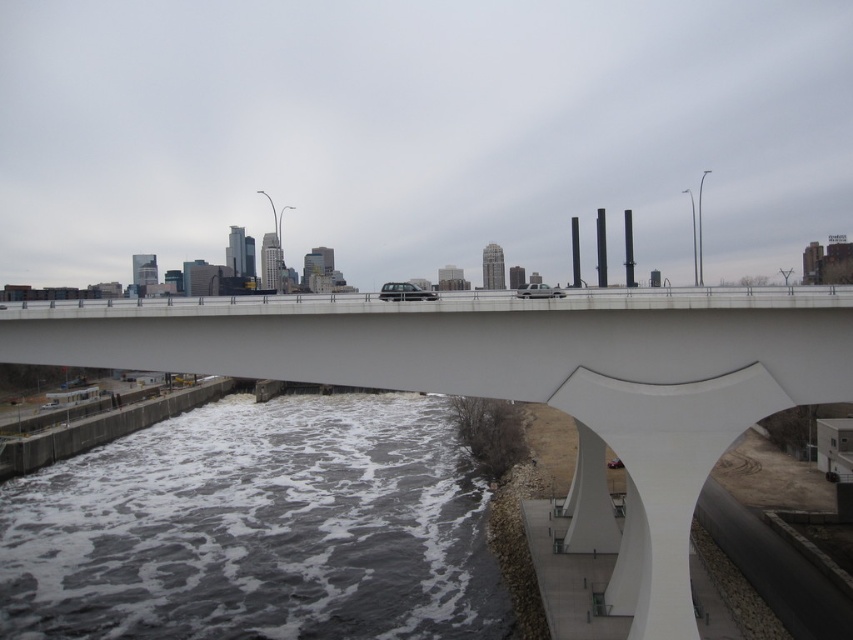
Question: Which point appears closest to the camera in this image?

Choices:
 (A) (244, 404)
 (B) (434, 362)

Answer: (B)

Question: Is white frothy water at lower center thinner than white smooth bridge at center?

Choices:
 (A) no
 (B) yes

Answer: (A)

Question: Is white frothy water at lower center further to camera compared to white smooth bridge at center?

Choices:
 (A) no
 (B) yes

Answer: (B)

Question: Can you confirm if white frothy water at lower center is bigger than white smooth bridge at center?

Choices:
 (A) yes
 (B) no

Answer: (B)